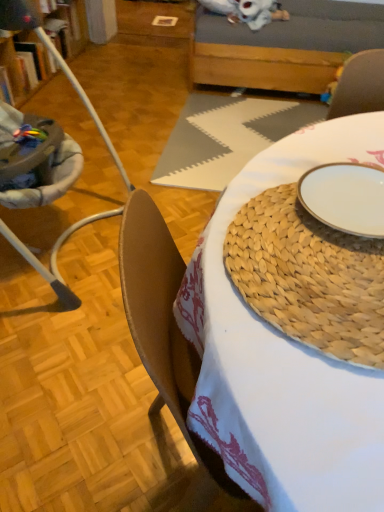
Question: Does velvet-like gray armchair at upper right appear on the left side of wooden couch at upper center?

Choices:
 (A) no
 (B) yes

Answer: (A)

Question: From a real-world perspective, is velvet-like gray armchair at upper right located higher than wooden couch at upper center?

Choices:
 (A) no
 (B) yes

Answer: (A)

Question: From the image's perspective, is velvet-like gray armchair at upper right under wooden couch at upper center?

Choices:
 (A) yes
 (B) no

Answer: (A)

Question: Considering the relative sizes of velvet-like gray armchair at upper right and wooden couch at upper center in the image provided, is velvet-like gray armchair at upper right taller than wooden couch at upper center?

Choices:
 (A) no
 (B) yes

Answer: (A)

Question: Is velvet-like gray armchair at upper right at the right side of wooden couch at upper center?

Choices:
 (A) yes
 (B) no

Answer: (A)

Question: In terms of height, does white ceramic plate at center look taller or shorter compared to velvet-like gray armchair at upper right?

Choices:
 (A) tall
 (B) short

Answer: (B)

Question: From a real-world perspective, is white ceramic plate at center positioned above or below velvet-like gray armchair at upper right?

Choices:
 (A) below
 (B) above

Answer: (B)

Question: Is point (322, 201) positioned closer to the camera than point (355, 61)?

Choices:
 (A) farther
 (B) closer

Answer: (B)

Question: Choose the correct answer: Is white ceramic plate at center inside velvet-like gray armchair at upper right or outside it?

Choices:
 (A) outside
 (B) inside

Answer: (A)

Question: From the image's perspective, is natural woven placemat at center positioned above or below white ceramic plate at center?

Choices:
 (A) below
 (B) above

Answer: (A)

Question: Is natural woven placemat at center wider or thinner than white ceramic plate at center?

Choices:
 (A) wide
 (B) thin

Answer: (A)

Question: From a real-world perspective, is natural woven placemat at center physically located above or below white ceramic plate at center?

Choices:
 (A) above
 (B) below

Answer: (B)

Question: Do you think natural woven placemat at center is within white ceramic plate at center, or outside of it?

Choices:
 (A) outside
 (B) inside

Answer: (A)

Question: Is white ceramic plate at center wider or thinner than brown leather chair at left?

Choices:
 (A) thin
 (B) wide

Answer: (A)

Question: Which is correct: white ceramic plate at center is inside brown leather chair at left, or outside of it?

Choices:
 (A) inside
 (B) outside

Answer: (B)